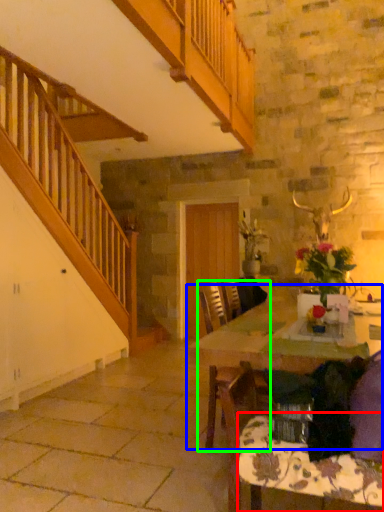
Question: Which object is positioned closest to tablecloth (highlighted by a red box)? Select from table (highlighted by a blue box) and chair (highlighted by a green box).

Choices:
 (A) table
 (B) chair

Answer: (B)